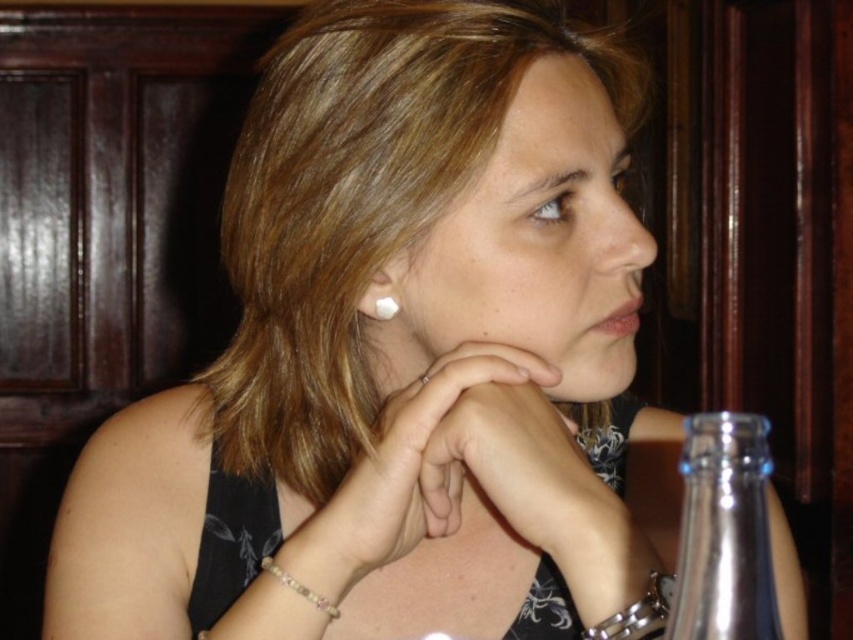
Is silver metallic chain at lower right wider than pearlelegantearring at ear?

Yes, silver metallic chain at lower right is wider than pearlelegantearring at ear.

Find the location of `silver metallic chain at lower right`. silver metallic chain at lower right is located at coordinates (637, 612).

Between pink beaded bracelet at lower center and pearlelegantearring at ear, which one has less height?

pearlelegantearring at ear is shorter.

This screenshot has width=853, height=640. What do you see at coordinates (299, 588) in the screenshot?
I see `pink beaded bracelet at lower center` at bounding box center [299, 588].

This screenshot has height=640, width=853. I want to click on pink beaded bracelet at lower center, so click(299, 588).

Can you confirm if clear glass bottle at right is shorter than silver metallic chain at lower right?

In fact, clear glass bottle at right may be taller than silver metallic chain at lower right.

Does clear glass bottle at right appear on the left side of silver metallic chain at lower right?

Incorrect, clear glass bottle at right is not on the left side of silver metallic chain at lower right.

Is point (689, 634) positioned after point (656, 595)?

No, it is not.

Where is `clear glass bottle at right`? clear glass bottle at right is located at coordinates (724, 532).